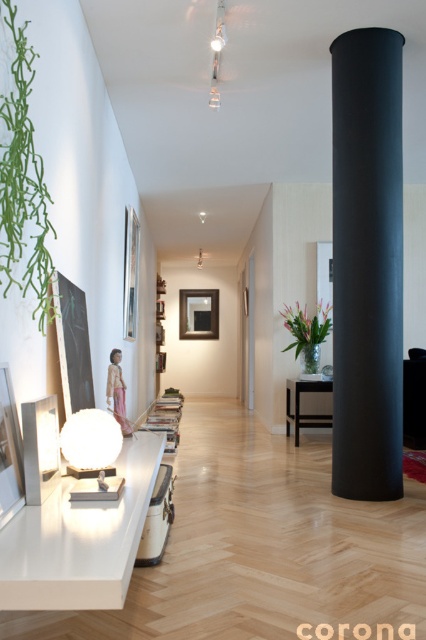
Which is below, black matte cylinder at center or pink fabric at center?

Positioned lower is pink fabric at center.

Is black matte cylinder at center positioned in front of pink fabric at center?

No, it is behind pink fabric at center.

The image size is (426, 640). Find the location of `black matte cylinder at center`. black matte cylinder at center is located at coordinates (367, 264).

Can you confirm if green matte plant at left is shorter than translucent glass vase at center-right?

No.

Is green matte plant at left smaller than translucent glass vase at center-right?

Indeed, green matte plant at left has a smaller size compared to translucent glass vase at center-right.

Find the location of a particular element. green matte plant at left is located at coordinates (23, 182).

Identify the location of green matte plant at left. The height and width of the screenshot is (640, 426). (23, 182).

Does green matte plant at left appear under black wood table at center?

No.

Which is in front, point (8, 218) or point (298, 392)?

Point (8, 218) is more forward.

You are a GUI agent. You are given a task and a screenshot of the screen. Output one action in this format:
    pyautogui.click(x=<x>, y=<y>)
    Task: Click on the green matte plant at left
    
    Given the screenshot: What is the action you would take?
    pyautogui.click(x=23, y=182)

This screenshot has height=640, width=426. I want to click on green matte plant at left, so click(23, 182).